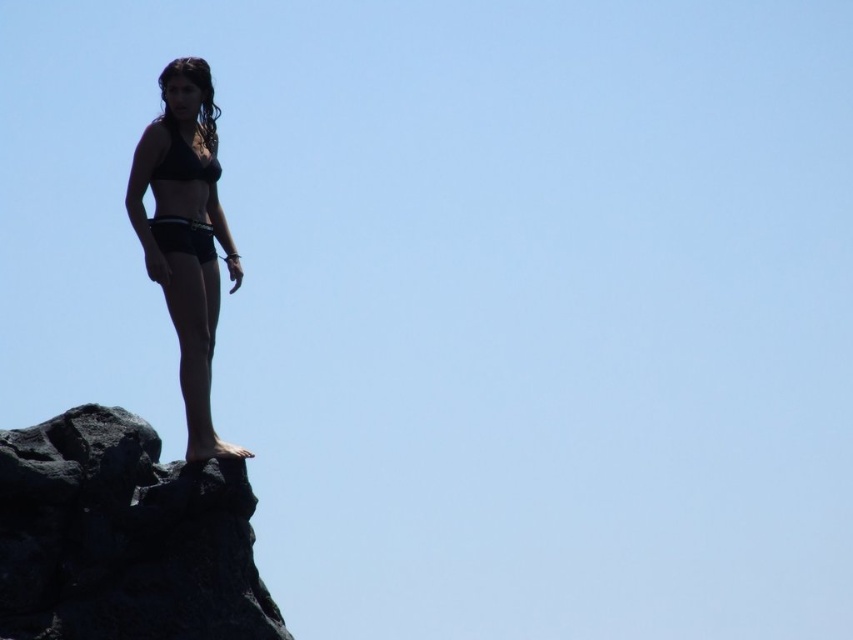
Is point (206, 64) positioned after point (170, 150)?

Yes, point (206, 64) is behind point (170, 150).

Can you confirm if black matte bikini top at upper left is thinner than black matte bikini top at upper center?

Incorrect, black matte bikini top at upper left's width is not less than black matte bikini top at upper center's.

Who is more forward, [222,456] or [154,179]?

Point [222,456]

In order to click on black matte bikini top at upper left in this screenshot , I will do `click(184, 234)`.

The width and height of the screenshot is (853, 640). What do you see at coordinates (123, 538) in the screenshot?
I see `black rough rock at upper left` at bounding box center [123, 538].

Does black rough rock at upper left have a greater width compared to black matte bikini top at upper center?

Yes.

This screenshot has height=640, width=853. What do you see at coordinates (123, 538) in the screenshot? I see `black rough rock at upper left` at bounding box center [123, 538].

Locate an element on the screen. The image size is (853, 640). black rough rock at upper left is located at coordinates (123, 538).

Is black rough rock at upper left thinner than black matte bikini top at upper left?

No.

Does black rough rock at upper left have a larger size compared to black matte bikini top at upper left?

Yes.

Does point (97, 419) come in front of point (157, 205)?

That is True.

What are the coordinates of `black rough rock at upper left` in the screenshot? It's located at (123, 538).